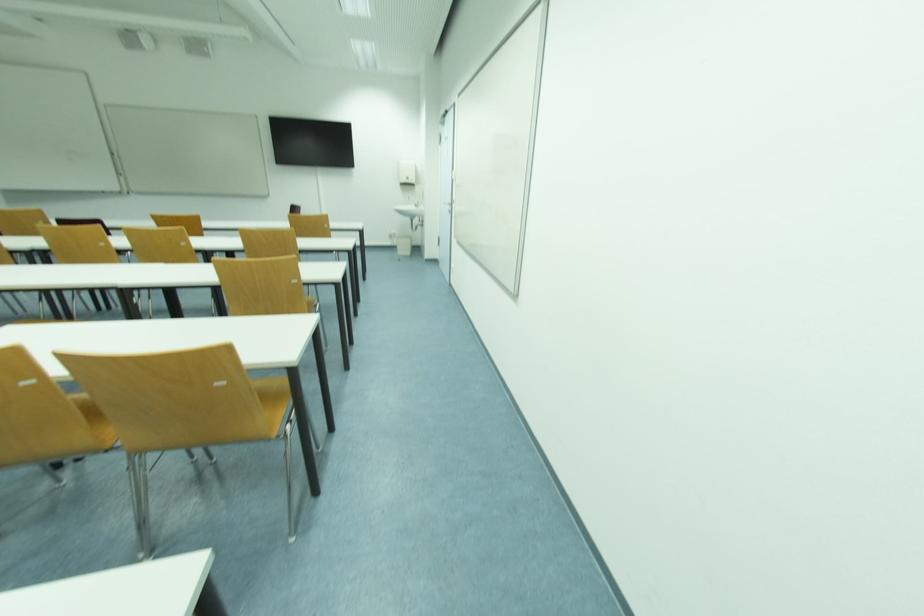
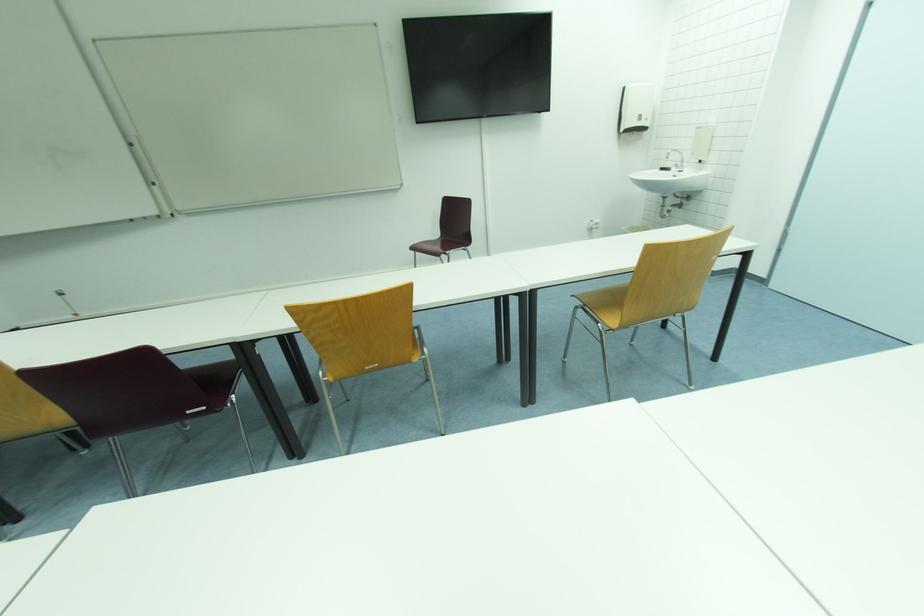
In a continuous first-person perspective shot, in which direction is the camera moving?

The cameraman walked toward left, forward.